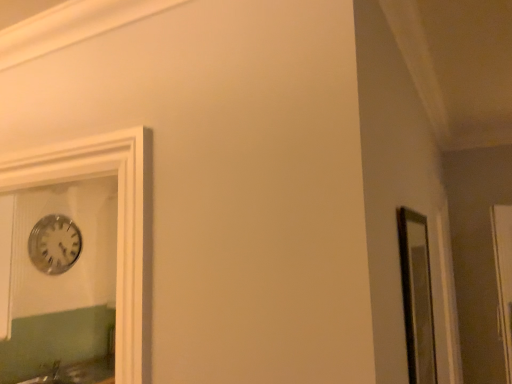
Describe the element at coordinates (54, 244) in the screenshot. This screenshot has height=384, width=512. I see `silver metallic clock at upper left` at that location.

What do you see at coordinates (417, 296) in the screenshot? The height and width of the screenshot is (384, 512). I see `matte glass mirror at right` at bounding box center [417, 296].

Where is `transparent glass door at right`? The width and height of the screenshot is (512, 384). transparent glass door at right is located at coordinates (504, 277).

Between point (63, 226) and point (401, 214), which one is positioned in front?

Positioned in front is point (401, 214).

Are silver metallic clock at upper left and matte glass mirror at right beside each other?

No, silver metallic clock at upper left is not in contact with matte glass mirror at right.

Looking at this image, can you confirm if silver metallic clock at upper left is wider than matte glass mirror at right?

Incorrect, the width of silver metallic clock at upper left does not surpass that of matte glass mirror at right.

Is silver metallic clock at upper left not within matte glass mirror at right?

Indeed, silver metallic clock at upper left is completely outside matte glass mirror at right.

Who is smaller, matte glass mirror at right or transparent glass door at right?

transparent glass door at right is smaller.

Choose the correct answer: Is matte glass mirror at right inside transparent glass door at right or outside it?

matte glass mirror at right is outside transparent glass door at right.

How many degrees apart are the facing directions of matte glass mirror at right and transparent glass door at right?

37.8 degrees separate the facing orientations of matte glass mirror at right and transparent glass door at right.

Between point (412, 284) and point (511, 267), which one is positioned in front?

The point (412, 284) is closer to the camera.

Which of these two, silver metallic clock at upper left or transparent glass door at right, is smaller?

silver metallic clock at upper left is smaller.

Which of these two, silver metallic clock at upper left or transparent glass door at right, is thinner?

With smaller width is silver metallic clock at upper left.

Can you confirm if silver metallic clock at upper left is positioned to the left of transparent glass door at right?

Correct, you'll find silver metallic clock at upper left to the left of transparent glass door at right.

Is silver metallic clock at upper left positioned before transparent glass door at right?

No, it is behind transparent glass door at right.

Considering the relative sizes of transparent glass door at right and matte glass mirror at right in the image provided, is transparent glass door at right shorter than matte glass mirror at right?

No, transparent glass door at right is not shorter than matte glass mirror at right.

From the picture: Is transparent glass door at right further to the viewer compared to matte glass mirror at right?

Yes, the depth of transparent glass door at right is greater than that of matte glass mirror at right.

In the scene shown: Is transparent glass door at right not near matte glass mirror at right?

They are positioned close to each other.

Can you confirm if transparent glass door at right is positioned to the left of matte glass mirror at right?

In fact, transparent glass door at right is to the right of matte glass mirror at right.

Is point (418, 246) closer to camera compared to point (60, 239)?

That is True.

Is matte glass mirror at right positioned far away from silver metallic clock at upper left?

matte glass mirror at right is positioned a significant distance from silver metallic clock at upper left.

Consider the image. In terms of height, does matte glass mirror at right look taller or shorter compared to silver metallic clock at upper left?

In the image, matte glass mirror at right appears to be taller than silver metallic clock at upper left.

From a real-world perspective, is transparent glass door at right above or below silver metallic clock at upper left?

transparent glass door at right is below silver metallic clock at upper left.

From the picture: In terms of width, does transparent glass door at right look wider or thinner when compared to silver metallic clock at upper left?

Considering their sizes, transparent glass door at right looks broader than silver metallic clock at upper left.

Is transparent glass door at right positioned with its back to silver metallic clock at upper left?

No.

Considering the positions of objects transparent glass door at right and silver metallic clock at upper left in the image provided, who is behind, transparent glass door at right or silver metallic clock at upper left?

silver metallic clock at upper left is behind.

Where is `window frame in front of the silver metallic clock at upper left`? window frame in front of the silver metallic clock at upper left is located at coordinates (417, 296).

Image resolution: width=512 pixels, height=384 pixels. In the image, there is a matte glass mirror at right. Find the location of `glass door below it (from the image's perspective)`. glass door below it (from the image's perspective) is located at coordinates (504, 277).

Which object lies nearer to the anchor point silver metallic clock at upper left, matte glass mirror at right or transparent glass door at right?

matte glass mirror at right.

Which object lies nearer to the anchor point silver metallic clock at upper left, transparent glass door at right or matte glass mirror at right?

matte glass mirror at right is positioned closer to the anchor silver metallic clock at upper left.

Looking at the image, which one is located closer to matte glass mirror at right, silver metallic clock at upper left or transparent glass door at right?

transparent glass door at right is positioned closer to the anchor matte glass mirror at right.

In the scene shown: Considering their positions, is transparent glass door at right positioned further to matte glass mirror at right than silver metallic clock at upper left?

Based on the image, silver metallic clock at upper left appears to be further to matte glass mirror at right.

When comparing their distances from transparent glass door at right, does matte glass mirror at right or silver metallic clock at upper left seem closer?

Among the two, matte glass mirror at right is located nearer to transparent glass door at right.

When comparing their distances from transparent glass door at right, does silver metallic clock at upper left or matte glass mirror at right seem closer?

Based on the image, matte glass mirror at right appears to be nearer to transparent glass door at right.

Find the location of a particular element. The width and height of the screenshot is (512, 384). window frame located between silver metallic clock at upper left and transparent glass door at right in the left-right direction is located at coordinates (417, 296).